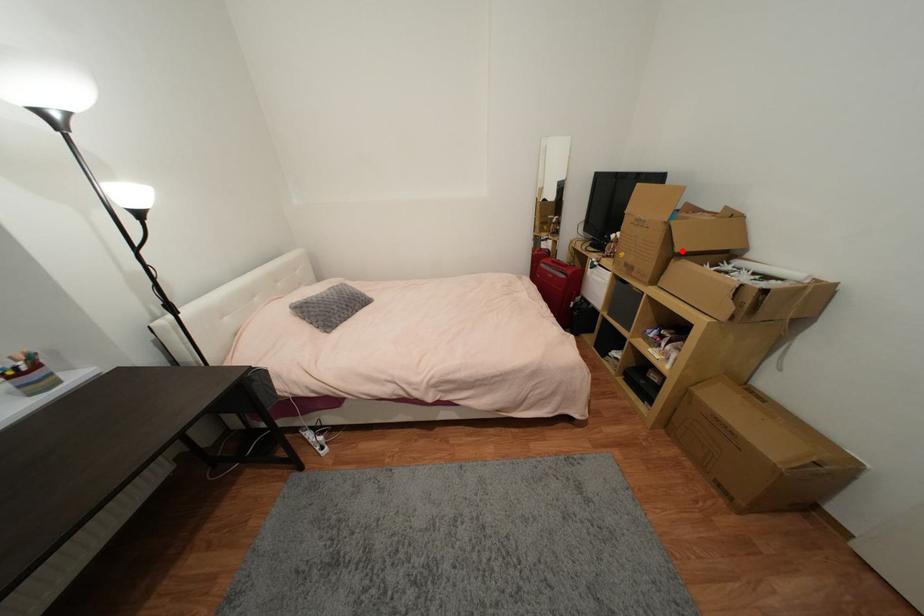
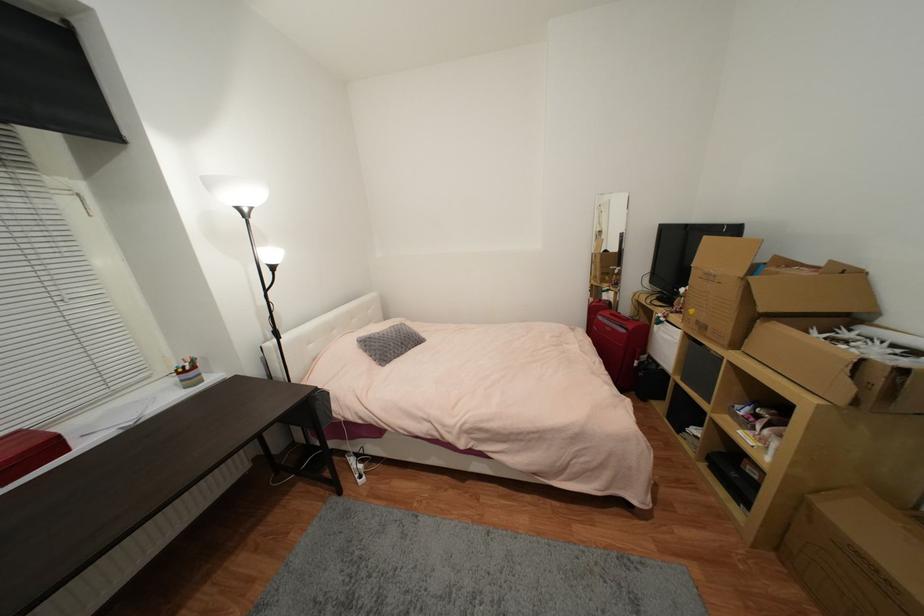
Find the pixel in the second image that matches the highlighted location in the first image.

(767, 310)